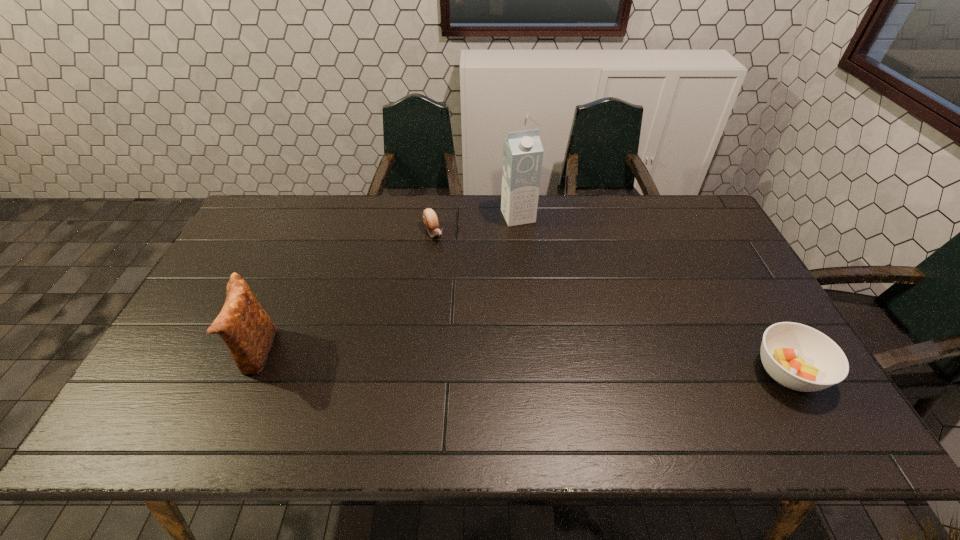
Where is `soup bowl that is at the near edge`? soup bowl that is at the near edge is located at coordinates (799, 357).

In order to click on object located in the right edge section of the desktop in this screenshot , I will do `click(799, 357)`.

The height and width of the screenshot is (540, 960). In order to click on object situated at the near right corner in this screenshot , I will do `click(799, 357)`.

Find the location of a particular element. The image size is (960, 540). vacant region at the far edge is located at coordinates (365, 196).

Locate an element on the screen. Image resolution: width=960 pixels, height=540 pixels. vacant space at the near edge of the desktop is located at coordinates (533, 393).

I want to click on vacant space at the left edge, so click(x=221, y=276).

Locate an element on the screen. vacant position at the right edge of the desktop is located at coordinates (712, 247).

At what (x,y) coordinates should I click in order to perform the action: click on free space at the far left corner of the desktop. Please return your answer as a coordinate pair (x, y). Image resolution: width=960 pixels, height=540 pixels. Looking at the image, I should click on (282, 201).

Find the location of a particular element. The height and width of the screenshot is (540, 960). vacant space at the near left corner of the desktop is located at coordinates (189, 398).

Where is `vacant area at the far right corner of the desktop`? This screenshot has height=540, width=960. vacant area at the far right corner of the desktop is located at coordinates (696, 213).